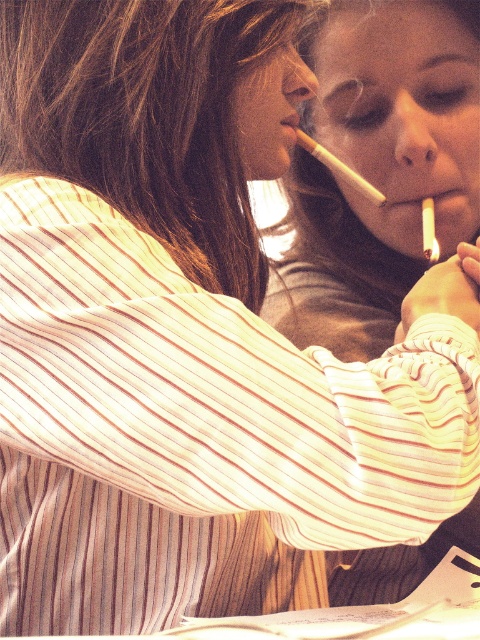
You are a photographer trying to capture both the white matte cigarette at upper right and the matte yellow cigarette at center in a single frame. Which cigarette should you focus on first if you want to ensure both are in focus, considering their sizes?

The white matte cigarette at upper right is taller than the matte yellow cigarette at center, so focusing on the larger one first might help maintain focus on both.

You are a photographer trying to capture a clear shot of the matte yellow cigarette at center without the matte gray shirt at center blocking it. Is it possible to adjust your angle to do so?

The matte gray shirt at center is positioned over the matte yellow cigarette at center, so adjusting your angle might not be possible to fully avoid the obstruction. However, tilting the camera slightly downward could reduce the overlap but may still show partial obstruction.